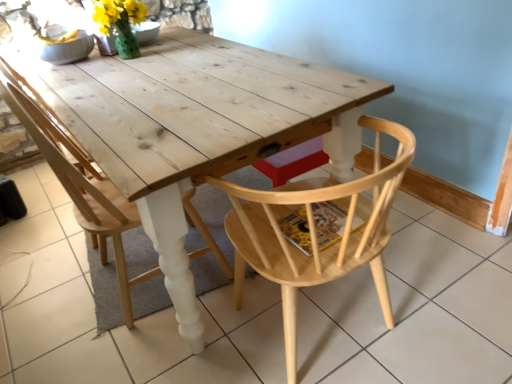
Locate an element on the screen. natural wood chair at center, the 2th chair positioned from the left is located at coordinates (316, 230).

In terms of height, does natural wood table at center look taller or shorter compared to natural wood chair at center, the 1th chair from the right?

natural wood table at center is shorter than natural wood chair at center, the 1th chair from the right.

Based on the photo, from a real-world perspective, is natural wood table at center located higher than natural wood chair at center, the 1th chair from the right?

No, from a real-world perspective, natural wood table at center is not over natural wood chair at center, the 1th chair from the right

Is natural wood chair at center, the 1th chair from the right, surrounded by natural wood table at center?

No, natural wood chair at center, the 1th chair from the right, is not inside natural wood table at center.

Identify the location of table located underneath the natural wood chair at center, the 2th chair positioned from the left (from a real-world perspective). This screenshot has width=512, height=384. (198, 126).

From the image's perspective, is natural wood chair at center, the 1th chair from the right, below natural wood chair at center, arranged as the 1th chair when viewed from the left?

Yes, from the image's perspective, natural wood chair at center, the 1th chair from the right, is beneath natural wood chair at center, arranged as the 1th chair when viewed from the left.

Considering their positions, is natural wood chair at center, the 2th chair positioned from the left, located in front of or behind natural wood chair at center, which is counted as the 2th chair, starting from the right?

Visually, natural wood chair at center, the 2th chair positioned from the left, is located in front of natural wood chair at center, which is counted as the 2th chair, starting from the right.

Considering the positions of objects natural wood table at center and natural wood chair at center, which is counted as the 2th chair, starting from the right, in the image provided, who is more to the left, natural wood table at center or natural wood chair at center, which is counted as the 2th chair, starting from the right,?

natural wood chair at center, which is counted as the 2th chair, starting from the right, is more to the left.

Considering the relative sizes of natural wood table at center and natural wood chair at center, which is counted as the 2th chair, starting from the right, in the image provided, is natural wood table at center smaller than natural wood chair at center, which is counted as the 2th chair, starting from the right,?

Actually, natural wood table at center might be larger than natural wood chair at center, which is counted as the 2th chair, starting from the right.

Can you see natural wood table at center touching natural wood chair at center, arranged as the 1th chair when viewed from the left?

There is a gap between natural wood table at center and natural wood chair at center, arranged as the 1th chair when viewed from the left.

Which object is thinner, natural wood table at center or natural wood chair at center, which is counted as the 2th chair, starting from the right?

Thinner between the two is natural wood chair at center, which is counted as the 2th chair, starting from the right.

Is the surface of natural wood chair at center, which is counted as the 2th chair, starting from the right, in direct contact with natural wood chair at center, the 1th chair from the right?

natural wood chair at center, which is counted as the 2th chair, starting from the right, is not next to natural wood chair at center, the 1th chair from the right, and they're not touching.

Is natural wood chair at center, the 2th chair positioned from the left, surrounded by natural wood chair at center, arranged as the 1th chair when viewed from the left?

No, natural wood chair at center, the 2th chair positioned from the left, is not inside natural wood chair at center, arranged as the 1th chair when viewed from the left.

How much distance is there between natural wood chair at center, arranged as the 1th chair when viewed from the left, and natural wood chair at center, the 1th chair from the right?

The distance of natural wood chair at center, arranged as the 1th chair when viewed from the left, from natural wood chair at center, the 1th chair from the right, is 18.65 inches.

From a real-world perspective, is natural wood chair at center, which is counted as the 2th chair, starting from the right, on natural wood chair at center, the 1th chair from the right?

Indeed, from a real-world perspective, natural wood chair at center, which is counted as the 2th chair, starting from the right, stands above natural wood chair at center, the 1th chair from the right.

Is natural wood chair at center, arranged as the 1th chair when viewed from the left, positioned beyond the bounds of natural wood table at center?

Yes, natural wood chair at center, arranged as the 1th chair when viewed from the left, is not within natural wood table at center.

Which of these two, natural wood chair at center, arranged as the 1th chair when viewed from the left, or natural wood table at center, stands taller?

Standing taller between the two is natural wood chair at center, arranged as the 1th chair when viewed from the left.

Does natural wood chair at center, which is counted as the 2th chair, starting from the right, have a lesser width compared to natural wood table at center?

Correct, the width of natural wood chair at center, which is counted as the 2th chair, starting from the right, is less than that of natural wood table at center.

Based on the photo, does natural wood chair at center, which is counted as the 2th chair, starting from the right, lie behind natural wood table at center?

Yes, it is behind natural wood table at center.

What's the angular difference between natural wood chair at center, the 2th chair positioned from the left, and natural wood table at center's facing directions?

89.8 degrees separate the facing orientations of natural wood chair at center, the 2th chair positioned from the left, and natural wood table at center.

Based on the photo, from a real-world perspective, who is located higher, natural wood chair at center, the 1th chair from the right, or natural wood table at center?

In real-world perspective, natural wood chair at center, the 1th chair from the right, is above.

Identify the location of table in front of the natural wood chair at center, the 1th chair from the right. This screenshot has width=512, height=384. (198, 126).

In terms of width, does natural wood chair at center, the 2th chair positioned from the left, look wider or thinner when compared to natural wood table at center?

natural wood chair at center, the 2th chair positioned from the left, is thinner than natural wood table at center.

I want to click on chair that is on the right side of natural wood table at center, so click(x=316, y=230).

Identify the location of chair behind the natural wood chair at center, the 1th chair from the right. The width and height of the screenshot is (512, 384). (83, 189).

Considering their positions, is natural wood table at center positioned closer to natural wood chair at center, which is counted as the 2th chair, starting from the right, than natural wood chair at center, the 1th chair from the right?

natural wood table at center.

Looking at the image, which one is located further to natural wood chair at center, the 2th chair positioned from the left, natural wood table at center or natural wood chair at center, which is counted as the 2th chair, starting from the right?

Based on the image, natural wood chair at center, which is counted as the 2th chair, starting from the right, appears to be further to natural wood chair at center, the 2th chair positioned from the left.

Estimate the real-world distances between objects in this image. Which object is further from natural wood chair at center, which is counted as the 2th chair, starting from the right, natural wood chair at center, the 1th chair from the right, or natural wood table at center?

natural wood chair at center, the 1th chair from the right, lies further to natural wood chair at center, which is counted as the 2th chair, starting from the right, than the other object.

Considering their positions, is natural wood chair at center, arranged as the 1th chair when viewed from the left, positioned closer to natural wood chair at center, the 2th chair positioned from the left, than natural wood table at center?

natural wood table at center.

From the image, which object appears to be nearer to natural wood table at center, natural wood chair at center, the 2th chair positioned from the left, or natural wood chair at center, which is counted as the 2th chair, starting from the right?

Among the two, natural wood chair at center, which is counted as the 2th chair, starting from the right, is located nearer to natural wood table at center.

Which object lies further to the anchor point natural wood table at center, natural wood chair at center, arranged as the 1th chair when viewed from the left, or natural wood chair at center, the 2th chair positioned from the left?

Among the two, natural wood chair at center, the 2th chair positioned from the left, is located further to natural wood table at center.

Identify the location of table between natural wood chair at center, which is counted as the 2th chair, starting from the right, and natural wood chair at center, the 2th chair positioned from the left. The image size is (512, 384). (198, 126).